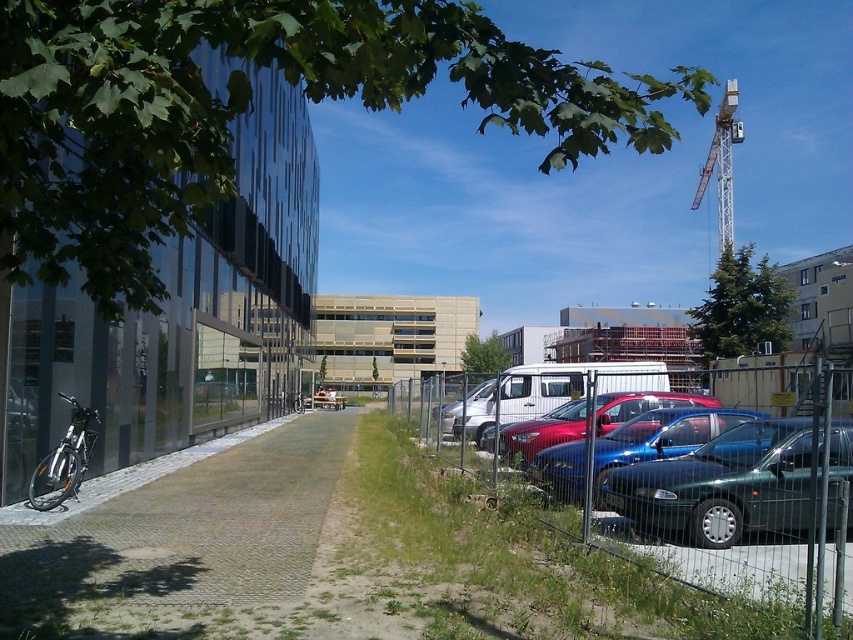
Question: Which point is closer to the camera?

Choices:
 (A) (676, 422)
 (B) (477, 406)
 (C) (636, 406)
 (D) (74, 406)

Answer: (A)

Question: Can you confirm if shiny metallic bicycle at left is positioned below metallic white crane at upper right?

Choices:
 (A) no
 (B) yes

Answer: (B)

Question: Which point is closer to the camera?

Choices:
 (A) metallic white crane at upper right
 (B) metallic blue sedan at right
 (C) metallic wire mesh fence at right

Answer: (C)

Question: Can you confirm if metallic blue sedan at right is positioned above metallic white crane at upper right?

Choices:
 (A) no
 (B) yes

Answer: (A)

Question: Is metallic wire mesh fence at right smaller than metallic blue sedan at center?

Choices:
 (A) yes
 (B) no

Answer: (B)

Question: Which object is closer to the camera taking this photo?

Choices:
 (A) silver metallic van at center
 (B) white matte van at center
 (C) metallic white crane at upper right

Answer: (B)